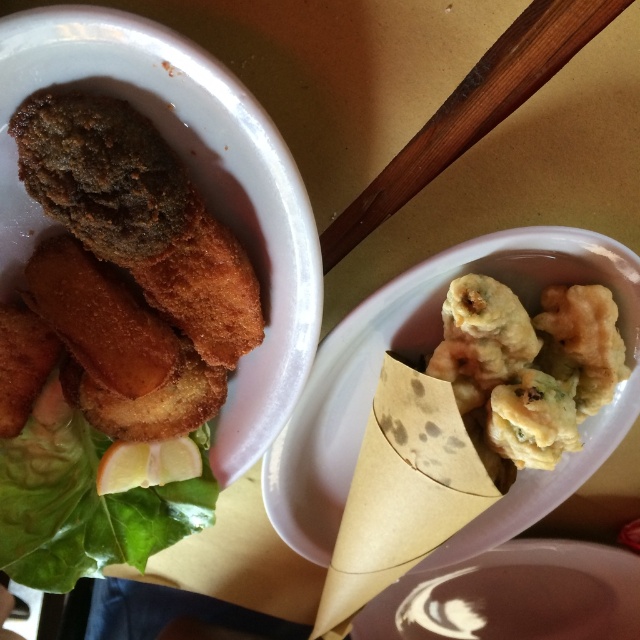
Question: Can you confirm if golden crispy breaded fish fillet at left is positioned to the right of fried golden-brown dumplings at center?

Choices:
 (A) no
 (B) yes

Answer: (A)

Question: Which of the following is the closest to the observer?

Choices:
 (A) (99, 253)
 (B) (458, 371)

Answer: (A)

Question: Is golden crispy breaded fish fillet at left smaller than fried golden-brown dumplings at center?

Choices:
 (A) yes
 (B) no

Answer: (B)

Question: Observing the image, what is the correct spatial positioning of golden crispy breaded fish fillet at left in reference to fried golden-brown dumplings at center?

Choices:
 (A) left
 (B) right

Answer: (A)